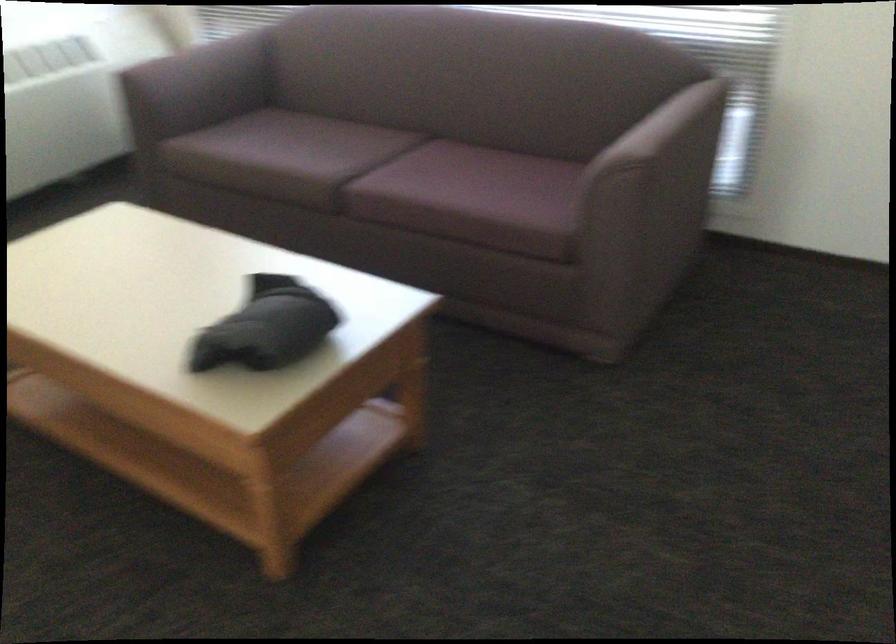
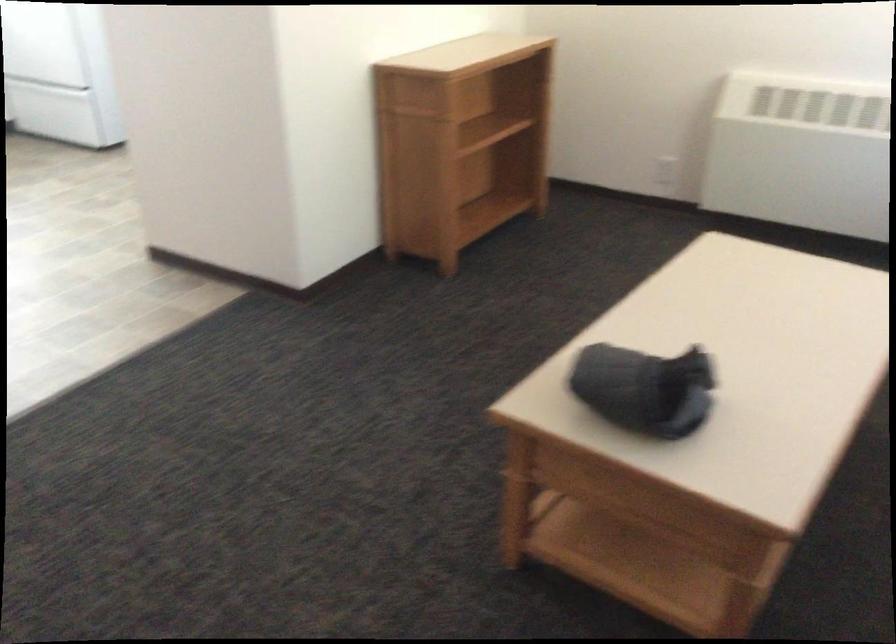
Locate, in the second image, the point that corresponds to the point at 288,313 in the first image.

(644, 389)